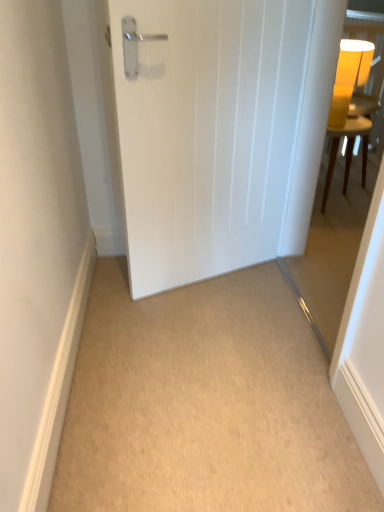
Question: From the image's perspective, would you say transparent glass door at right is shown under white matte door at center?

Choices:
 (A) yes
 (B) no

Answer: (A)

Question: Does transparent glass door at right touch white matte door at center?

Choices:
 (A) no
 (B) yes

Answer: (A)

Question: Is transparent glass door at right bigger than white matte door at center?

Choices:
 (A) yes
 (B) no

Answer: (A)

Question: Is transparent glass door at right behind white matte door at center?

Choices:
 (A) yes
 (B) no

Answer: (B)

Question: Is transparent glass door at right completely or partially outside of white matte door at center?

Choices:
 (A) no
 (B) yes

Answer: (B)

Question: Is white matte door at center taller or shorter than yellow matte table lamp at upper right?

Choices:
 (A) short
 (B) tall

Answer: (B)

Question: From a real-world perspective, is white matte door at center positioned above or below yellow matte table lamp at upper right?

Choices:
 (A) below
 (B) above

Answer: (A)

Question: Considering the positions of white matte door at center and yellow matte table lamp at upper right in the image, is white matte door at center wider or thinner than yellow matte table lamp at upper right?

Choices:
 (A) wide
 (B) thin

Answer: (B)

Question: Looking at the image, does white matte door at center seem bigger or smaller compared to yellow matte table lamp at upper right?

Choices:
 (A) big
 (B) small

Answer: (A)

Question: Is yellow wood table at upper right spatially inside transparent glass door at right, or outside of it?

Choices:
 (A) inside
 (B) outside

Answer: (B)

Question: From a real-world perspective, is yellow wood table at upper right above or below transparent glass door at right?

Choices:
 (A) below
 (B) above

Answer: (A)

Question: Based on their sizes in the image, would you say yellow wood table at upper right is bigger or smaller than transparent glass door at right?

Choices:
 (A) small
 (B) big

Answer: (A)

Question: In the image, is yellow wood table at upper right positioned in front of or behind transparent glass door at right?

Choices:
 (A) front
 (B) behind

Answer: (B)

Question: Considering the positions of white matte door at center and beige carpet at center in the image, is white matte door at center bigger or smaller than beige carpet at center?

Choices:
 (A) small
 (B) big

Answer: (B)

Question: Considering the relative positions of white matte door at center and beige carpet at center in the image provided, is white matte door at center to the left or to the right of beige carpet at center?

Choices:
 (A) right
 (B) left

Answer: (A)